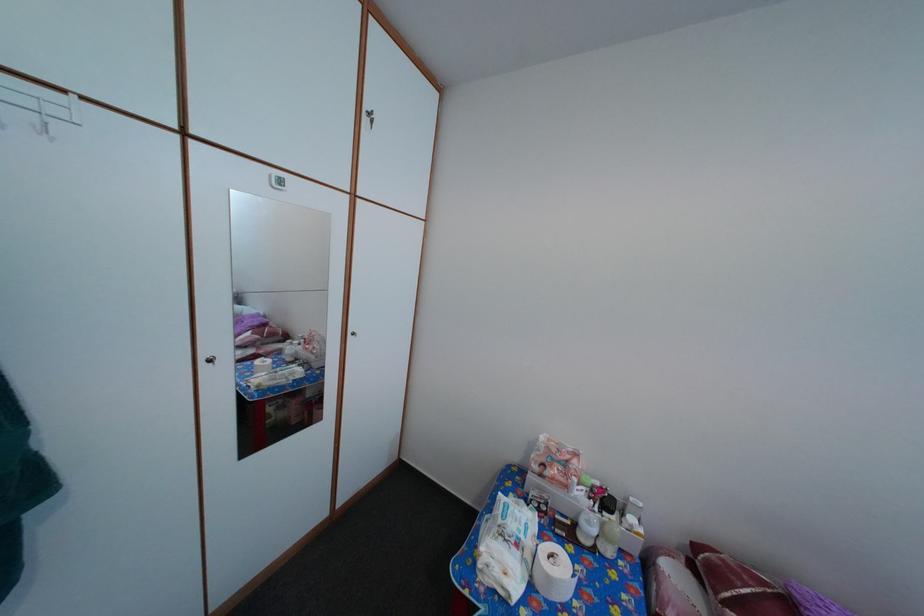
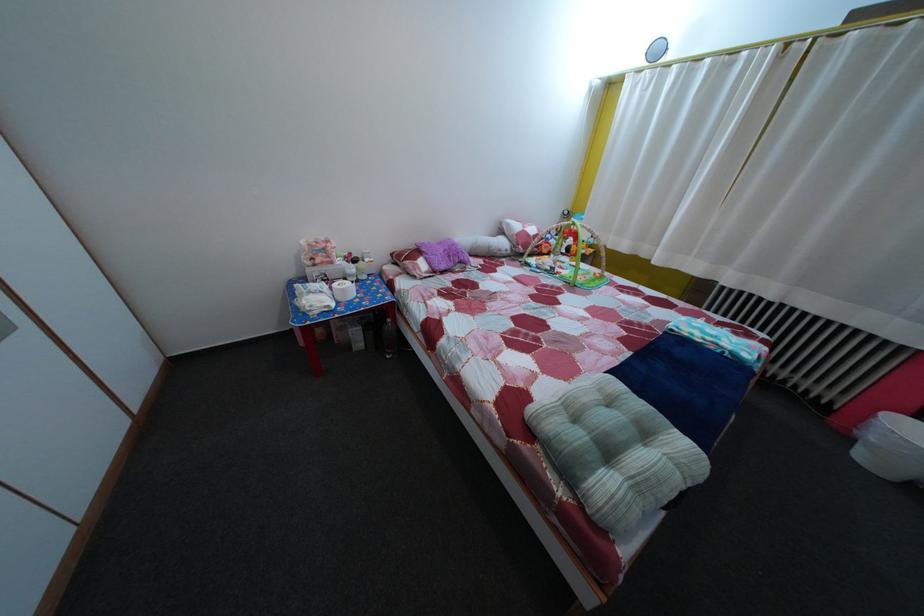
The point at (555, 512) is marked in the first image. Where is the corresponding point in the second image?

(335, 284)